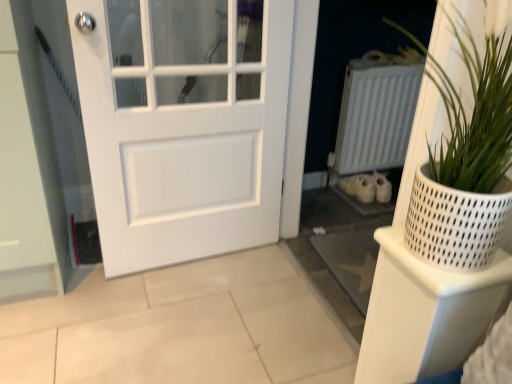
Identify the location of vacant area that lies to the right of white matte door at center. (273, 289).